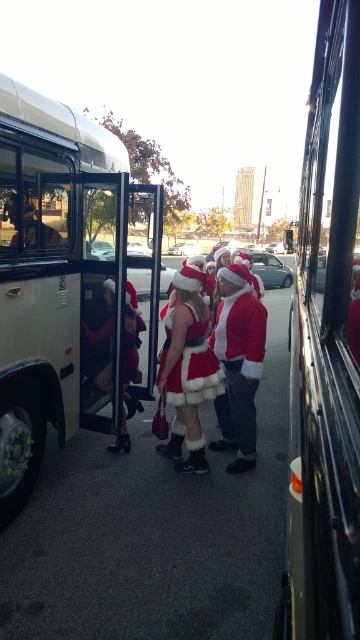
Question: Does fuzzy red santa at center have a lesser width compared to fuzzy red dress at center?

Choices:
 (A) yes
 (B) no

Answer: (B)

Question: Which point is closer to the camera taking this photo?

Choices:
 (A) (174, 397)
 (B) (263, 356)

Answer: (A)

Question: Which object appears farthest from the camera in this image?

Choices:
 (A) fuzzy white santa suit at center
 (B) fuzzy red santa at center
 (C) fuzzy red dress at center
 (D) metallic silver bus at right

Answer: (A)

Question: Which point is closer to the camera?

Choices:
 (A) (163, 369)
 (B) (327, 548)
 (C) (54, 220)
 (D) (177, 353)

Answer: (B)

Question: Can you confirm if metallic silver bus at right is smaller than fuzzy white santa suit at center?

Choices:
 (A) no
 (B) yes

Answer: (B)

Question: Is metallic silver bus at right below fuzzy red santa at center?

Choices:
 (A) no
 (B) yes

Answer: (A)